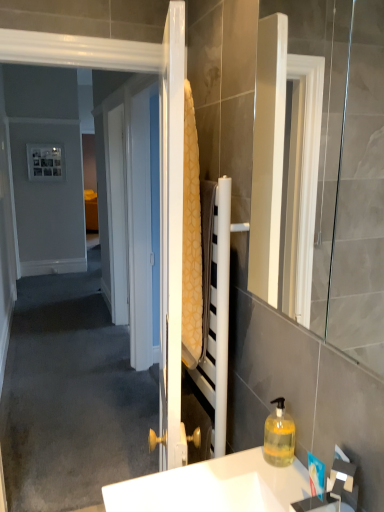
The width and height of the screenshot is (384, 512). Find the location of `free spot in front of translucent yellow liquid at lower right`. free spot in front of translucent yellow liquid at lower right is located at coordinates (278, 480).